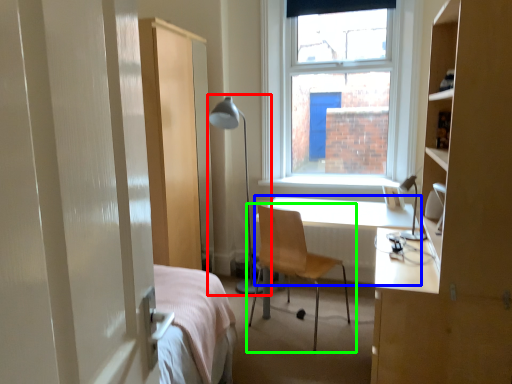
Question: Which object is the closest to the table lamp (highlighted by a red box)? Choose among these: desk (highlighted by a blue box) or chair (highlighted by a green box).

Choices:
 (A) desk
 (B) chair

Answer: (A)